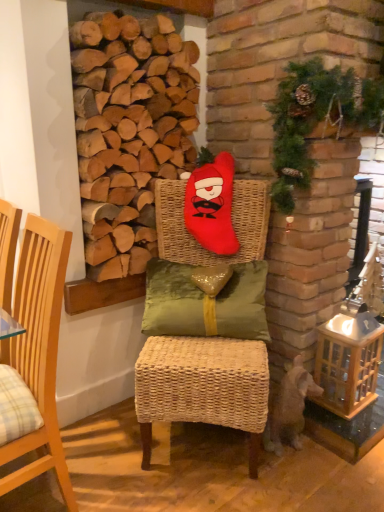
Question: Can you confirm if light wood chair at left, which appears as the 1th chair when viewed from the left, is thinner than matte red plush at center, the second chair from the left?

Choices:
 (A) no
 (B) yes

Answer: (B)

Question: From a real-world perspective, is light wood chair at left, which appears as the 1th chair when viewed from the left, over matte red plush at center, the second chair from the left?

Choices:
 (A) yes
 (B) no

Answer: (B)

Question: Is light wood chair at left, which appears as the 1th chair when viewed from the left, aimed at matte red plush at center, which is the 1th chair from right to left?

Choices:
 (A) no
 (B) yes

Answer: (A)

Question: Is light wood chair at left, which appears as the 1th chair when viewed from the left, closer to camera compared to matte red plush at center, which is the 1th chair from right to left?

Choices:
 (A) yes
 (B) no

Answer: (A)

Question: Is light wood chair at left, the second chair in the right-to-left sequence, at the left side of matte red plush at center, which is the 1th chair from right to left?

Choices:
 (A) yes
 (B) no

Answer: (A)

Question: From a real-world perspective, is matte red plush at center, which is the 1th chair from right to left, above or below red plush santa at center?

Choices:
 (A) below
 (B) above

Answer: (A)

Question: From their relative heights in the image, would you say matte red plush at center, which is the 1th chair from right to left, is taller or shorter than red plush santa at center?

Choices:
 (A) tall
 (B) short

Answer: (A)

Question: Does point (254, 406) appear closer or farther from the camera than point (205, 189)?

Choices:
 (A) farther
 (B) closer

Answer: (B)

Question: Based on their positions, is matte red plush at center, the second chair from the left, located to the left or right of red plush santa at center?

Choices:
 (A) left
 (B) right

Answer: (A)

Question: Considering the positions of point (192, 195) and point (41, 471), is point (192, 195) closer or farther from the camera than point (41, 471)?

Choices:
 (A) closer
 (B) farther

Answer: (B)

Question: From a real-world perspective, is red plush santa at center physically located above or below light wood chair at left, which appears as the 1th chair when viewed from the left?

Choices:
 (A) above
 (B) below

Answer: (A)

Question: Considering their positions, is red plush santa at center located in front of or behind light wood chair at left, the second chair in the right-to-left sequence?

Choices:
 (A) behind
 (B) front

Answer: (A)

Question: Is red plush santa at center bigger or smaller than light wood chair at left, the second chair in the right-to-left sequence?

Choices:
 (A) small
 (B) big

Answer: (A)

Question: From the image's perspective, is green textured wreath at upper right positioned above or below matte red plush at center, which is the 1th chair from right to left?

Choices:
 (A) above
 (B) below

Answer: (A)

Question: Looking at their shapes, would you say green textured wreath at upper right is wider or thinner than matte red plush at center, which is the 1th chair from right to left?

Choices:
 (A) thin
 (B) wide

Answer: (A)